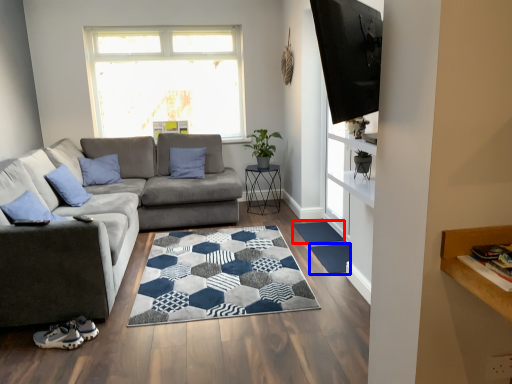
Question: Which object is further to the camera taking this photo, doormat (highlighted by a red box) or doormat (highlighted by a blue box)?

Choices:
 (A) doormat
 (B) doormat

Answer: (A)